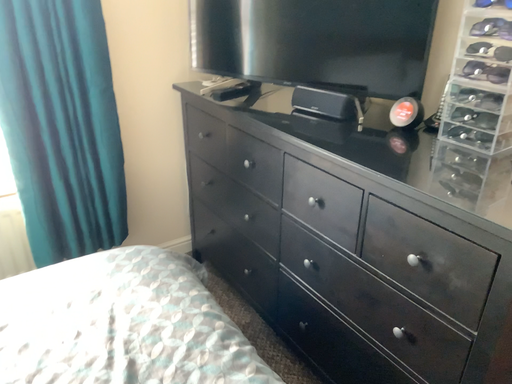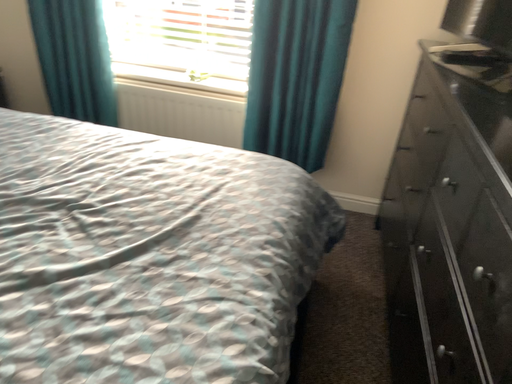
Question: How did the camera likely rotate when shooting the video?

Choices:
 (A) rotated upward
 (B) rotated downward

Answer: (A)